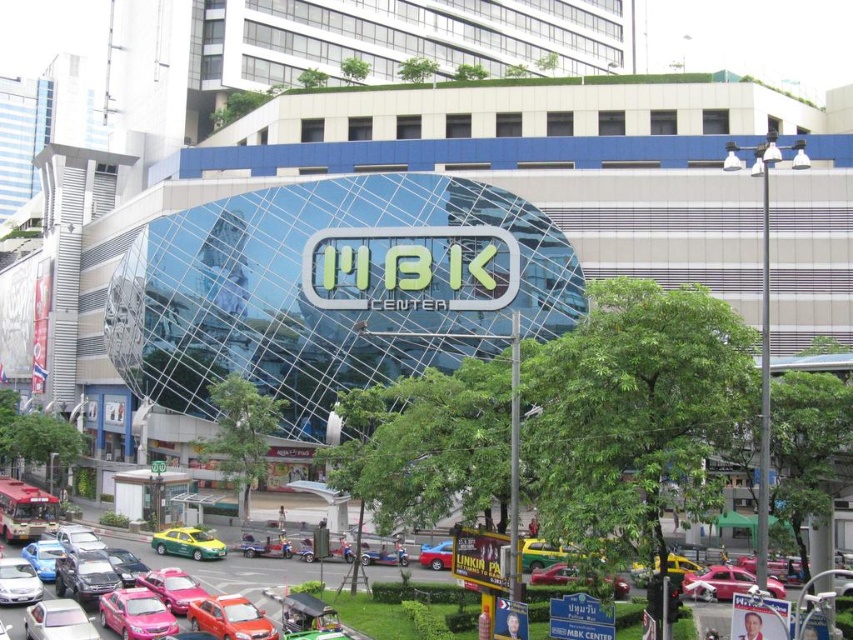
Can you confirm if metallic green taxi at center is shorter than yellow metallic taxi at center?

Incorrect, metallic green taxi at center's height does not fall short of yellow metallic taxi at center's.

Which is behind, point (556, 556) or point (692, 572)?

Point (556, 556)

Find the location of `metallic green taxi at center`. metallic green taxi at center is located at coordinates 543,554.

Can you confirm if yellow metallic taxi at center is bigger than metallic silver car at center?

Yes, yellow metallic taxi at center is bigger than metallic silver car at center.

Does point (659, 563) come in front of point (393, 548)?

Yes.

The image size is (853, 640). What are the coordinates of `yellow metallic taxi at center` in the screenshot? It's located at (680, 566).

Which is below, pink glossy car at center or metallic red car at center?

pink glossy car at center is below.

Find the location of a particular element. pink glossy car at center is located at coordinates click(135, 612).